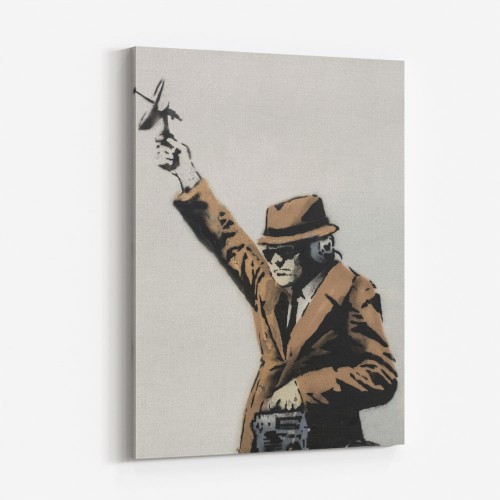
The image size is (500, 500). Find the location of `canvas`. canvas is located at coordinates (184, 330).